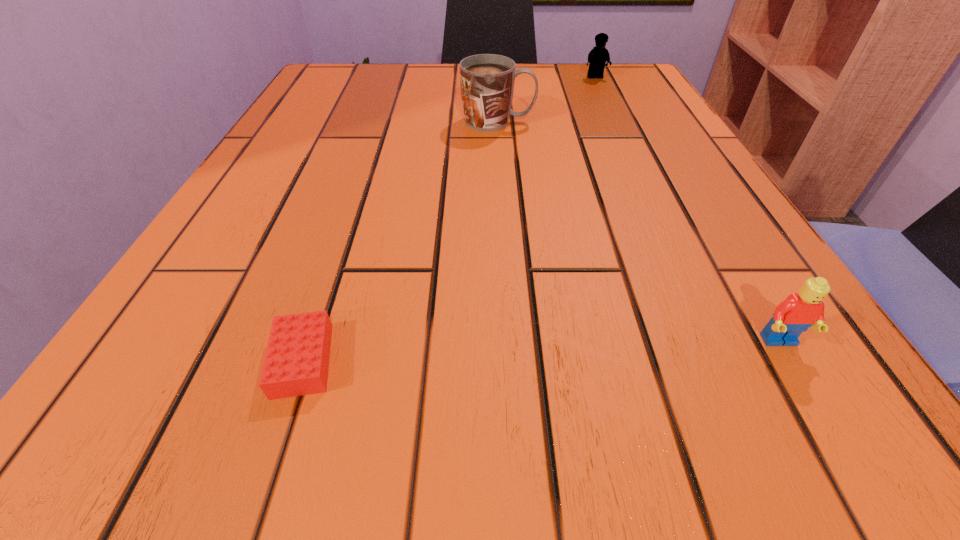
Locate an element on the screen. The width and height of the screenshot is (960, 540). vacant space situated 0.240m on the right of the leftmost object is located at coordinates (563, 361).

Locate an element on the screen. object present at the far edge is located at coordinates (598, 56).

Locate an element on the screen. This screenshot has height=540, width=960. object that is positioned at the near edge is located at coordinates (296, 363).

Where is `object positioned at the left edge`? The width and height of the screenshot is (960, 540). object positioned at the left edge is located at coordinates (296, 363).

At what (x,y) coordinates should I click in order to perform the action: click on object that is at the near left corner. Please return your answer as a coordinate pair (x, y). Image resolution: width=960 pixels, height=540 pixels. Looking at the image, I should click on (296, 363).

You are a GUI agent. You are given a task and a screenshot of the screen. Output one action in this format:
    pyautogui.click(x=<x>, y=<y>)
    Task: Click on the object at the far right corner
    
    Given the screenshot: What is the action you would take?
    pyautogui.click(x=598, y=56)

The image size is (960, 540). I want to click on vacant space at the far edge of the desktop, so click(392, 97).

You are a GUI agent. You are given a task and a screenshot of the screen. Output one action in this format:
    pyautogui.click(x=<x>, y=<y>)
    Task: Click on the vacant space at the near edge of the desktop
    This screenshot has width=960, height=540.
    Given the screenshot: What is the action you would take?
    pyautogui.click(x=431, y=428)

Where is `blank space at the left edge of the desktop`? This screenshot has height=540, width=960. blank space at the left edge of the desktop is located at coordinates (278, 263).

You are a GUI agent. You are given a task and a screenshot of the screen. Output one action in this format:
    pyautogui.click(x=<x>, y=<y>)
    Task: Click on the vacant position at the right edge of the desktop
    The width and height of the screenshot is (960, 540).
    Given the screenshot: What is the action you would take?
    click(x=741, y=331)